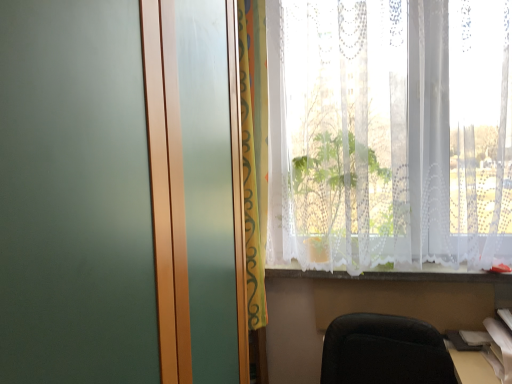
Question: Is white paper at lower right oriented towards multicolored fabric curtain at center?

Choices:
 (A) no
 (B) yes

Answer: (A)

Question: Is white paper at lower right shorter than multicolored fabric curtain at center?

Choices:
 (A) yes
 (B) no

Answer: (A)

Question: Can you confirm if white paper at lower right is wider than multicolored fabric curtain at center?

Choices:
 (A) no
 (B) yes

Answer: (A)

Question: From the image's perspective, does white paper at lower right appear higher than multicolored fabric curtain at center?

Choices:
 (A) yes
 (B) no

Answer: (B)

Question: Is white paper at lower right thinner than multicolored fabric curtain at center?

Choices:
 (A) no
 (B) yes

Answer: (B)

Question: Is multicolored fabric curtain at center surrounded by white paper at lower right?

Choices:
 (A) no
 (B) yes

Answer: (A)

Question: Is multicolored fabric curtain at center behind white lace curtain at lower center?

Choices:
 (A) no
 (B) yes

Answer: (A)

Question: Is the position of multicolored fabric curtain at center less distant than that of white lace curtain at lower center?

Choices:
 (A) yes
 (B) no

Answer: (A)

Question: Is multicolored fabric curtain at center wider than white lace curtain at lower center?

Choices:
 (A) no
 (B) yes

Answer: (B)

Question: Does multicolored fabric curtain at center have a lesser width compared to white lace curtain at lower center?

Choices:
 (A) no
 (B) yes

Answer: (A)

Question: From a real-world perspective, is multicolored fabric curtain at center beneath white lace curtain at lower center?

Choices:
 (A) no
 (B) yes

Answer: (A)

Question: From a real-world perspective, is multicolored fabric curtain at center on top of white lace curtain at lower center?

Choices:
 (A) yes
 (B) no

Answer: (A)

Question: Considering the relative sizes of multicolored fabric curtain at center and white paper at lower right in the image provided, is multicolored fabric curtain at center taller than white paper at lower right?

Choices:
 (A) no
 (B) yes

Answer: (B)